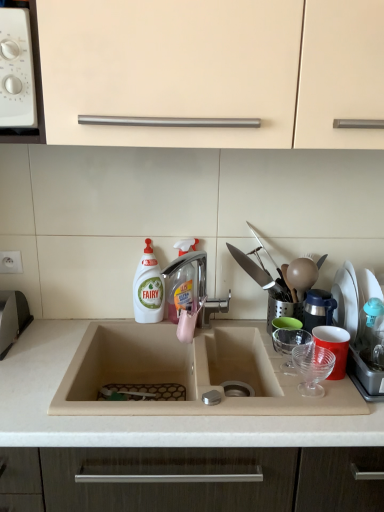
Question: Does white plastic bottle at center have a larger size compared to beige matte cabinet at upper center?

Choices:
 (A) no
 (B) yes

Answer: (A)

Question: From a real-world perspective, is white plastic bottle at center located beneath beige matte cabinet at upper center?

Choices:
 (A) no
 (B) yes

Answer: (B)

Question: From the image's perspective, does white plastic bottle at center appear higher than beige matte cabinet at upper center?

Choices:
 (A) no
 (B) yes

Answer: (A)

Question: Considering the relative sizes of white plastic bottle at center and beige matte cabinet at upper center in the image provided, is white plastic bottle at center taller than beige matte cabinet at upper center?

Choices:
 (A) no
 (B) yes

Answer: (A)

Question: Is white plastic bottle at center positioned far away from beige matte cabinet at upper center?

Choices:
 (A) no
 (B) yes

Answer: (A)

Question: Is silver metallic tap at center inside or outside of transparent plastic spray bottle at center?

Choices:
 (A) outside
 (B) inside

Answer: (A)

Question: Is silver metallic tap at center wider or thinner than transparent plastic spray bottle at center?

Choices:
 (A) wide
 (B) thin

Answer: (A)

Question: Considering their positions, is silver metallic tap at center located in front of or behind transparent plastic spray bottle at center?

Choices:
 (A) behind
 (B) front

Answer: (B)

Question: Considering the positions of point pyautogui.click(x=203, y=315) and point pyautogui.click(x=188, y=292), is point pyautogui.click(x=203, y=315) closer or farther from the camera than point pyautogui.click(x=188, y=292)?

Choices:
 (A) farther
 (B) closer

Answer: (A)

Question: From the image's perspective, is beige matte cabinet at upper center positioned above or below red plastic cup at right?

Choices:
 (A) above
 (B) below

Answer: (A)

Question: Considering the positions of point (332, 133) and point (334, 313), is point (332, 133) closer or farther from the camera than point (334, 313)?

Choices:
 (A) farther
 (B) closer

Answer: (B)

Question: Is beige matte cabinet at upper center spatially inside red plastic cup at right, or outside of it?

Choices:
 (A) inside
 (B) outside

Answer: (B)

Question: Is beige matte cabinet at upper center wider or thinner than red plastic cup at right?

Choices:
 (A) wide
 (B) thin

Answer: (A)

Question: In terms of size, does transparent plastic spray bottle at center appear bigger or smaller than white plastic knobs at upper left?

Choices:
 (A) big
 (B) small

Answer: (B)

Question: Choose the correct answer: Is transparent plastic spray bottle at center inside white plastic knobs at upper left or outside it?

Choices:
 (A) outside
 (B) inside

Answer: (A)